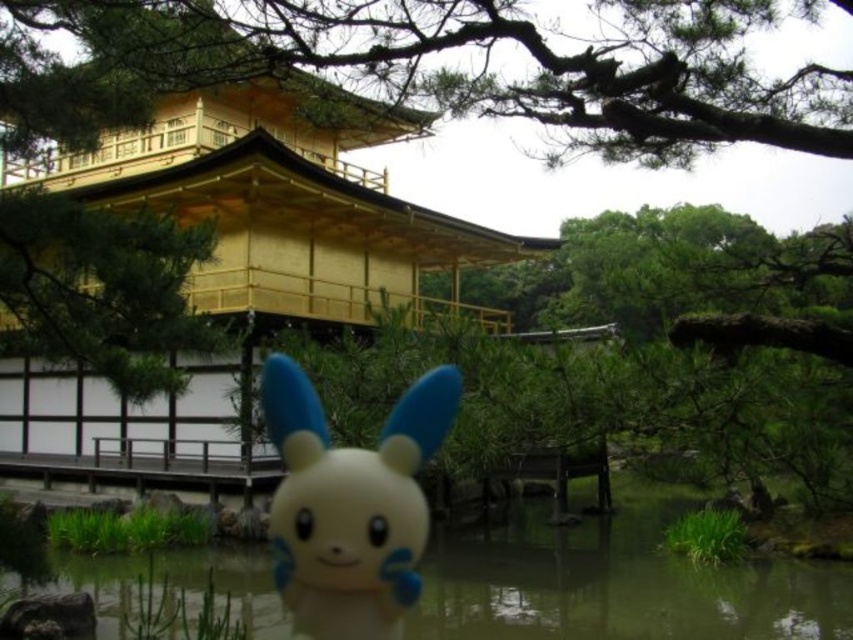
What do you see at coordinates (616, 580) in the screenshot?
I see `transparent plastic water at lower center` at bounding box center [616, 580].

Locate an element on the screen. The image size is (853, 640). transparent plastic water at lower center is located at coordinates (x=616, y=580).